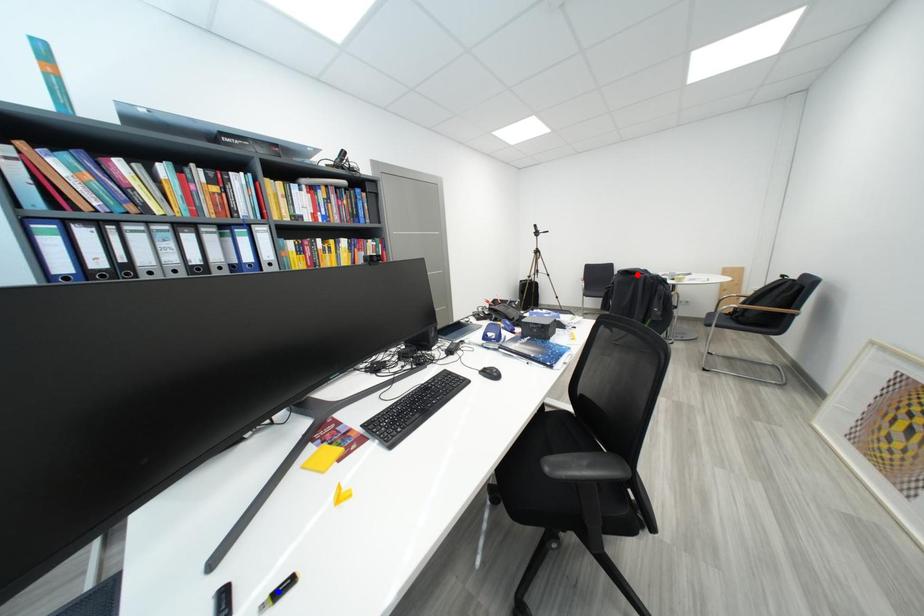
Question: Which of the two points in the image is closer to the camera?

Choices:
 (A) Blue point is closer.
 (B) Red point is closer.

Answer: (A)